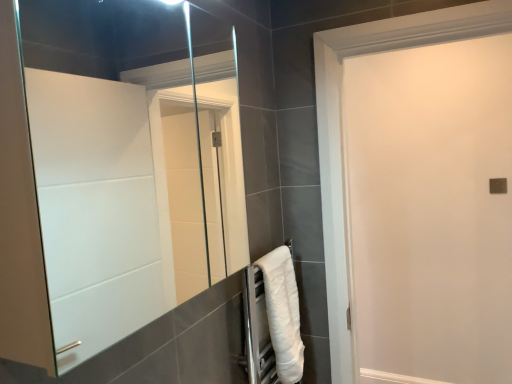
Question: Would you say white fluffy towel at lower right is inside or outside clear glass mirror at center?

Choices:
 (A) inside
 (B) outside

Answer: (B)

Question: In the image, is white fluffy towel at lower right positioned in front of or behind clear glass mirror at center?

Choices:
 (A) behind
 (B) front

Answer: (A)

Question: Considering the real-world distances, which object is closest to the clear glass mirror at center?

Choices:
 (A) white matte door at center
 (B) white fluffy towel at lower right

Answer: (B)

Question: Estimate the real-world distances between objects in this image. Which object is closer to the white matte door at center?

Choices:
 (A) clear glass mirror at center
 (B) white fluffy towel at lower right

Answer: (A)